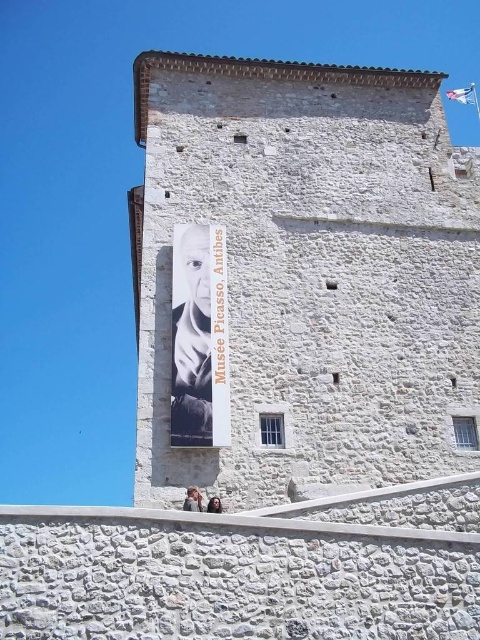
You are a tour guide explaining the Mus??e Picasso, Antibes to visitors. You point out the white stone tower at center and the white paper poster at center. Which object is wider?

The white stone tower at center is wider than the white paper poster at center.

Based on the scene description, where is the white stone tower at center located in terms of its 2D coordinates?

The white stone tower at center is located at the 2D coordinates of point (300, 282).

You are standing in front of the Mus??e Picasso, Antibes. You see a white stone tower at center and a white paper poster at center. Which object is positioned to the right of the other?

The white stone tower at center is to the right of the white paper poster at center.